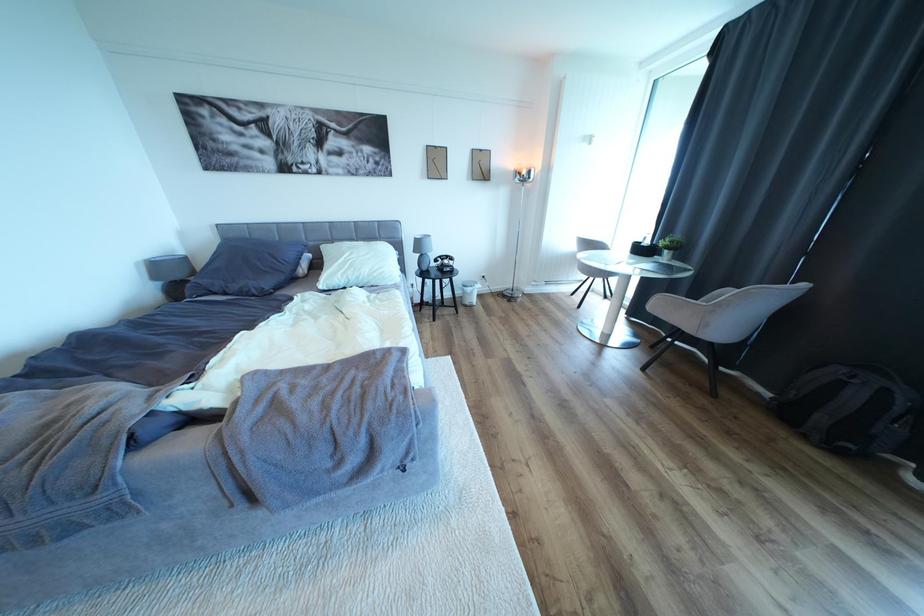
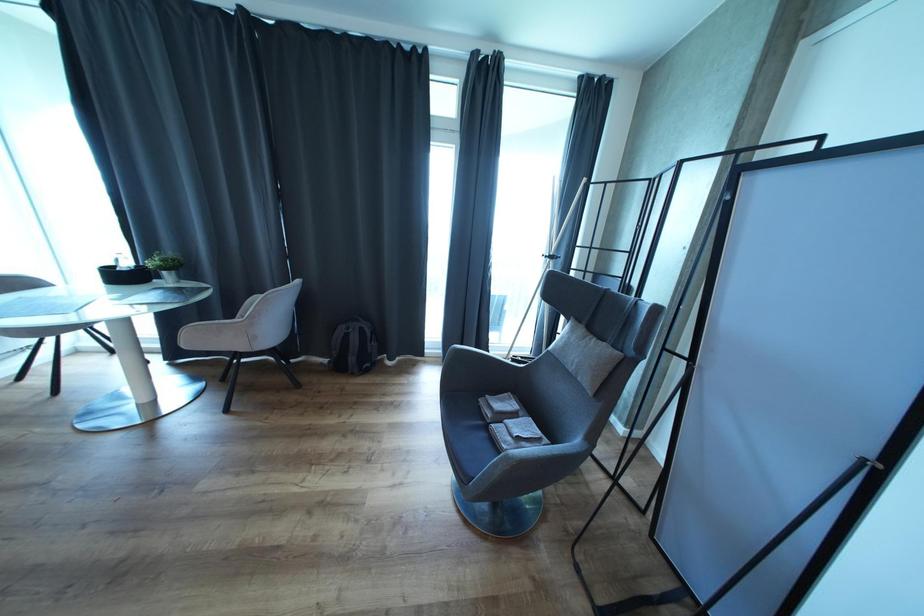
From the picture: First-person continuous shooting, in which direction is the camera rotating?

The camera's rotation is toward right-down.